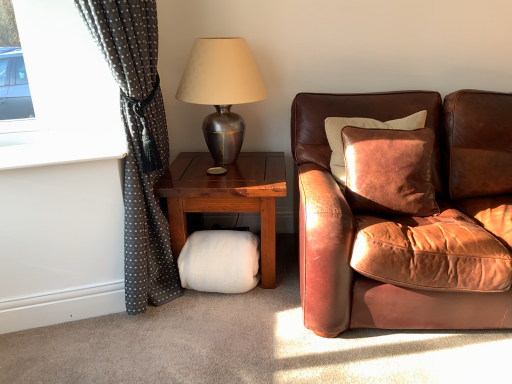
Question: From the image's perspective, is metallic silver lamp at upper center on dark grey polka dot fabric at left?

Choices:
 (A) yes
 (B) no

Answer: (A)

Question: From a real-world perspective, is metallic silver lamp at upper center over dark grey polka dot fabric at left?

Choices:
 (A) yes
 (B) no

Answer: (A)

Question: Does metallic silver lamp at upper center turn towards dark grey polka dot fabric at left?

Choices:
 (A) yes
 (B) no

Answer: (B)

Question: Is metallic silver lamp at upper center outside dark grey polka dot fabric at left?

Choices:
 (A) no
 (B) yes

Answer: (B)

Question: Considering the relative positions of metallic silver lamp at upper center and dark grey polka dot fabric at left in the image provided, is metallic silver lamp at upper center in front of dark grey polka dot fabric at left?

Choices:
 (A) no
 (B) yes

Answer: (A)

Question: Is metallic silver lamp at upper center wider than dark grey polka dot fabric at left?

Choices:
 (A) no
 (B) yes

Answer: (A)

Question: Does white fluffy footrest at lower center contain dark grey polka dot fabric at left?

Choices:
 (A) no
 (B) yes

Answer: (A)

Question: Considering the relative sizes of white fluffy footrest at lower center and dark grey polka dot fabric at left in the image provided, is white fluffy footrest at lower center taller than dark grey polka dot fabric at left?

Choices:
 (A) yes
 (B) no

Answer: (B)

Question: Does white fluffy footrest at lower center lie behind dark grey polka dot fabric at left?

Choices:
 (A) yes
 (B) no

Answer: (A)

Question: Does white fluffy footrest at lower center have a larger size compared to dark grey polka dot fabric at left?

Choices:
 (A) yes
 (B) no

Answer: (B)

Question: Is white fluffy footrest at lower center far away from dark grey polka dot fabric at left?

Choices:
 (A) yes
 (B) no

Answer: (B)

Question: Does white fluffy footrest at lower center have a greater width compared to dark grey polka dot fabric at left?

Choices:
 (A) no
 (B) yes

Answer: (A)

Question: Considering the relative positions of white fluffy pillow at lower center and white fluffy footrest at lower center in the image provided, is white fluffy pillow at lower center to the left of white fluffy footrest at lower center from the viewer's perspective?

Choices:
 (A) no
 (B) yes

Answer: (A)